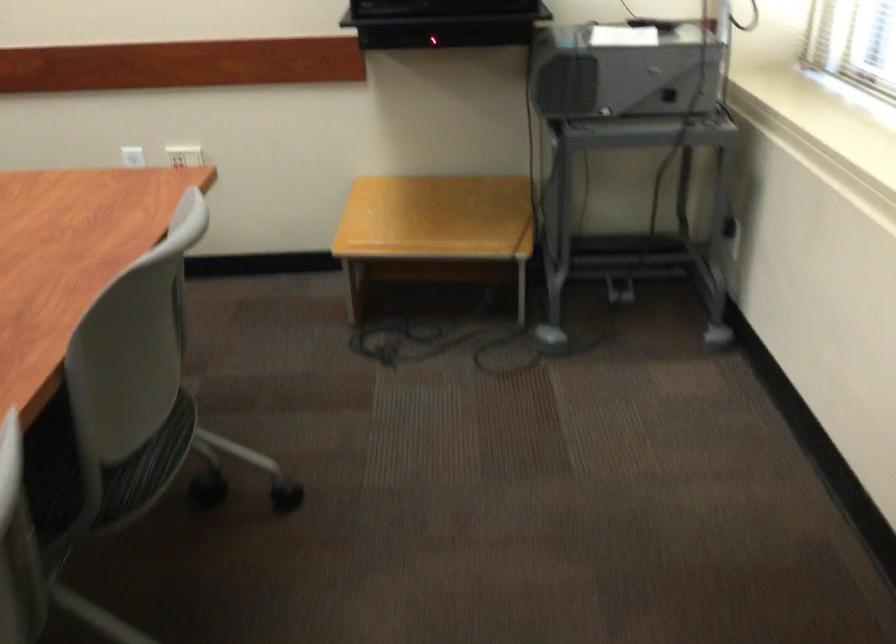
Image resolution: width=896 pixels, height=644 pixels. Describe the element at coordinates (61, 464) in the screenshot. I see `a chair sitting surface` at that location.